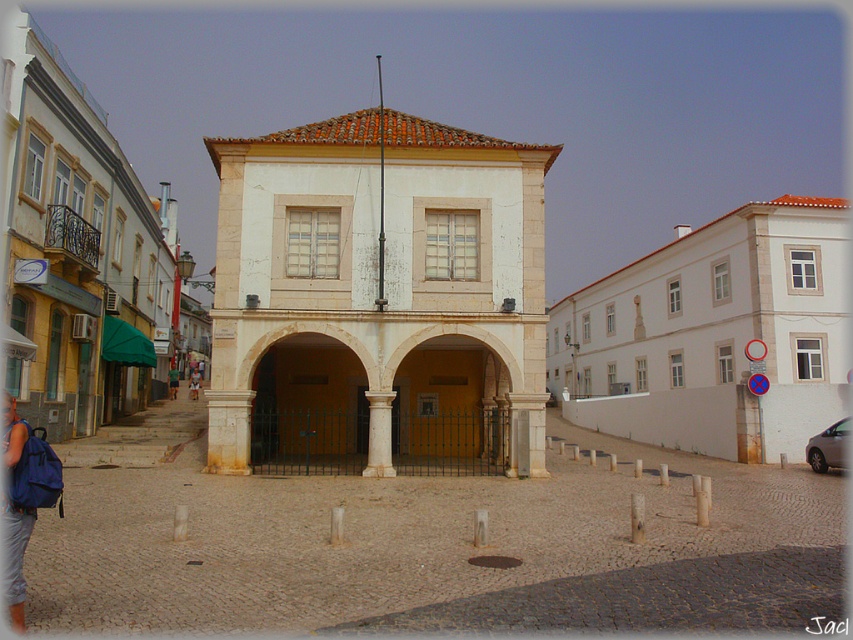
Question: Which object is farther from the camera taking this photo?

Choices:
 (A) brown stone archway at center
 (B) brown leather bag at center
 (C) green fabric bag at center
 (D) yellow matte archway at center

Answer: (C)

Question: Among these points, which one is nearest to the camera?

Choices:
 (A) (169, 381)
 (B) (427, 369)
 (C) (384, 442)
 (D) (321, 406)

Answer: (C)

Question: Which point is closer to the camera taking this photo?

Choices:
 (A) (169, 369)
 (B) (357, 401)
 (C) (392, 474)
 (D) (489, 412)

Answer: (C)

Question: Does white marble column at center appear over green fabric bag at center?

Choices:
 (A) yes
 (B) no

Answer: (B)

Question: Does yellow matte archway at center appear under brown leather bag at center?

Choices:
 (A) no
 (B) yes

Answer: (A)

Question: Can you confirm if brown stone archway at center is smaller than white marble column at center?

Choices:
 (A) no
 (B) yes

Answer: (A)